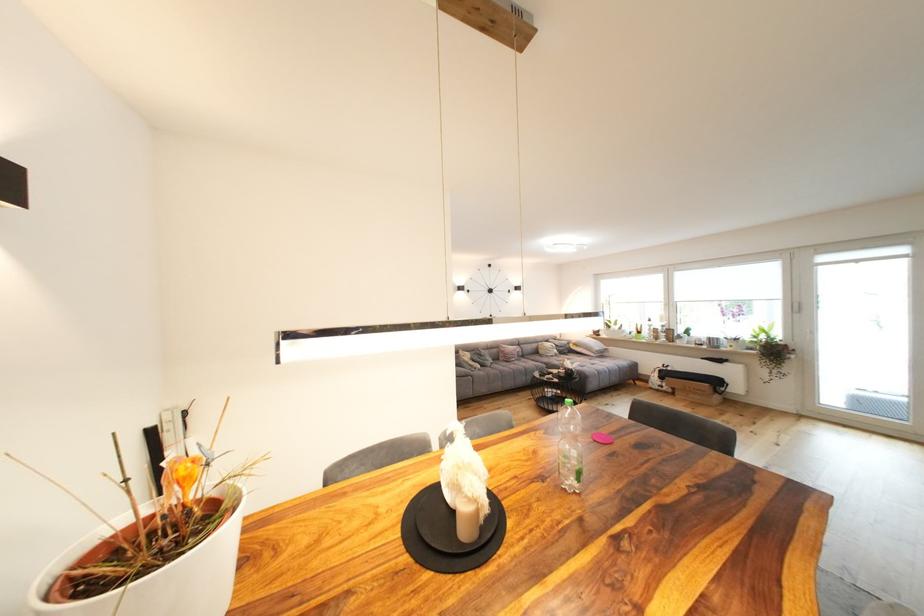
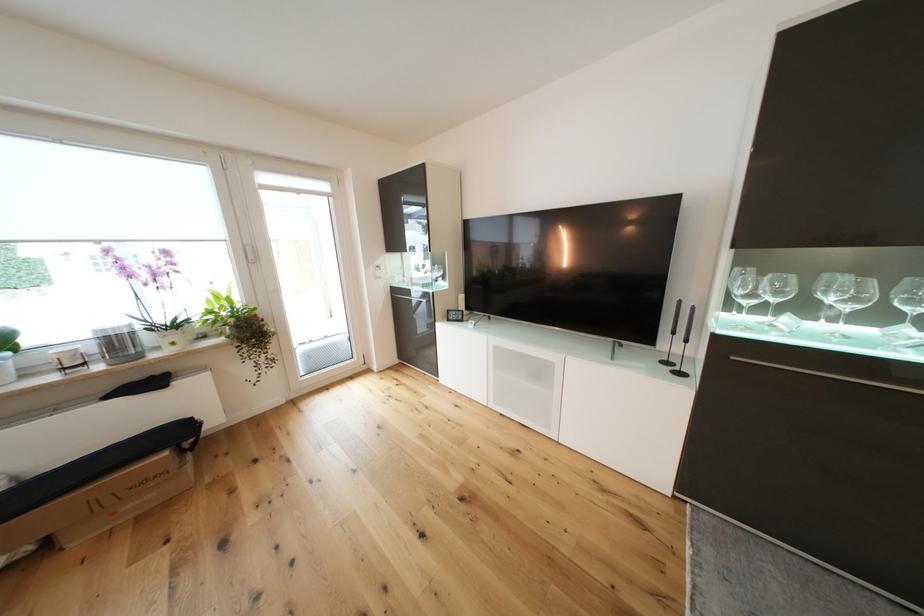
Locate, in the second image, the point that corresponds to point 723,384 in the first image.

(186, 435)